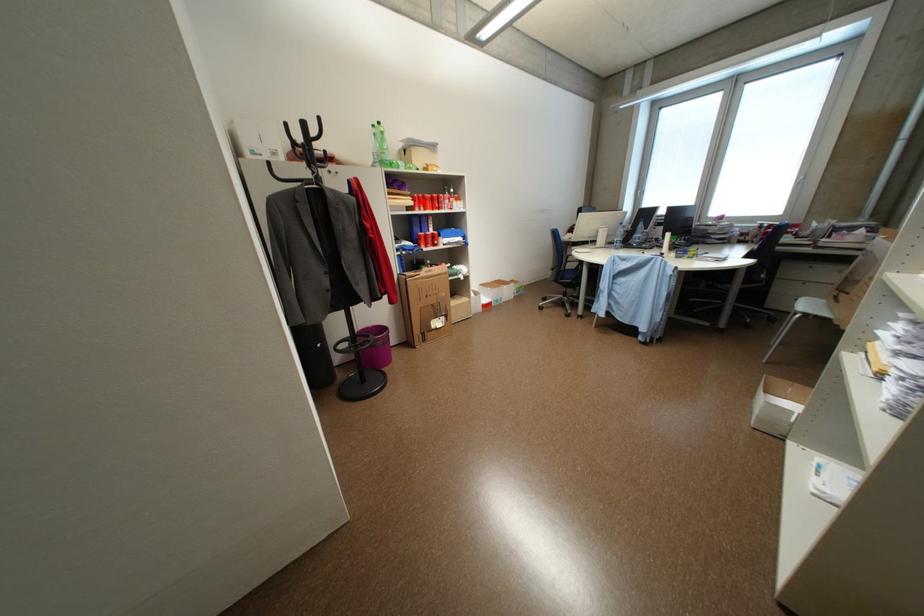
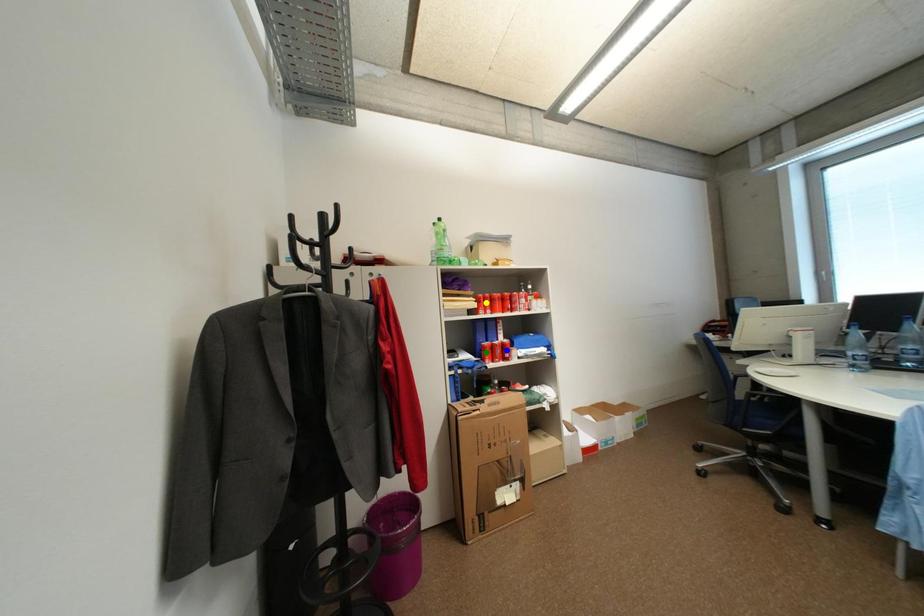
Question: I am providing you with two images of the same scene from different viewpoints. A red point is marked on the first image. You are given multiple points on the second image. Which spot in image 2 lines up with the point in image 1?

Choices:
 (A) yellow point
 (B) blue point
 (C) green point

Answer: (A)